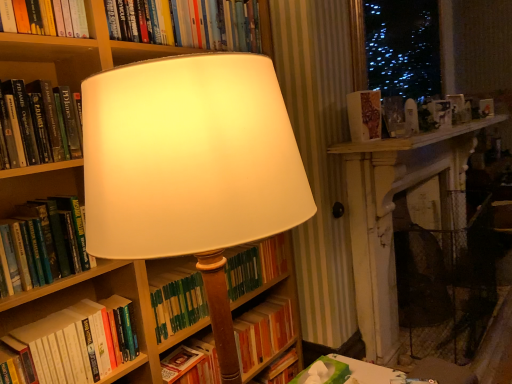
In order to face wooden bookcase at center, should I rotate leftwards or rightwards?

You should look left and rotate roughly 6.819 degrees.

Describe the element at coordinates (81, 341) in the screenshot. I see `hardcover book at left, positioned as the 6th book in top-to-bottom order` at that location.

This screenshot has height=384, width=512. I want to click on green matte book at center, which is counted as the 3th book, starting from the bottom, so click(x=177, y=300).

The width and height of the screenshot is (512, 384). I want to click on hardcover book at upper center, arranged as the first book when viewed from the top, so click(189, 23).

The image size is (512, 384). Describe the element at coordinates (189, 23) in the screenshot. I see `hardcover book at upper center, which ranks as the seventh book in bottom-to-top order` at that location.

This screenshot has height=384, width=512. Find the location of `patterned paper book at upper right, marked as the 6th book in a bottom-to-top arrangement`. patterned paper book at upper right, marked as the 6th book in a bottom-to-top arrangement is located at coordinates (364, 115).

This screenshot has height=384, width=512. Describe the element at coordinates (397, 47) in the screenshot. I see `blue lights at upper right` at that location.

The width and height of the screenshot is (512, 384). In order to click on hardcover book at left, the fourth book in the top-to-bottom sequence in this screenshot , I will do `click(45, 242)`.

Where is `wooden bookcase at center`? Image resolution: width=512 pixels, height=384 pixels. wooden bookcase at center is located at coordinates (210, 130).

From the image's perspective, count 2nd books downward from the hardcover book at left, which is the 4th book in bottom-to-top order, and point to it. Please provide its 2D coordinates.

[(81, 341)]

Is point (38, 338) less distant than point (44, 283)?

That is True.

Considering the positions of objects hardcover book at left, positioned as the 6th book in top-to-bottom order, and hardcover book at left, the fourth book in the top-to-bottom sequence, in the image provided, who is in front, hardcover book at left, positioned as the 6th book in top-to-bottom order, or hardcover book at left, the fourth book in the top-to-bottom sequence,?

hardcover book at left, the fourth book in the top-to-bottom sequence, is more forward.

Which object is further away from the camera, green matte book at center, marked as the 5th book in a top-to-bottom arrangement, or patterned paper book at upper right, which is the 2th book from top to bottom?

patterned paper book at upper right, which is the 2th book from top to bottom, is further from the camera.

Where is `book that is the 3rd one below the patterned paper book at upper right, which is the 2th book from top to bottom (from a real-world perspective)`? book that is the 3rd one below the patterned paper book at upper right, which is the 2th book from top to bottom (from a real-world perspective) is located at coordinates (177, 300).

Is hardcover book at left, which appears as the third book when viewed from the top, bigger than green hardcover book at center, which is the 1th book in bottom-to-top order?

Incorrect, hardcover book at left, which appears as the third book when viewed from the top, is not larger than green hardcover book at center, which is the 1th book in bottom-to-top order.

From a real-world perspective, does hardcover book at left, acting as the fifth book starting from the bottom, stand above green hardcover book at center, which is the 1th book in bottom-to-top order?

Yes.

Considering the sizes of hardcover book at left, which appears as the third book when viewed from the top, and green hardcover book at center, which is the 1th book in bottom-to-top order, in the image, is hardcover book at left, which appears as the third book when viewed from the top, wider or thinner than green hardcover book at center, which is the 1th book in bottom-to-top order,?

Considering their sizes, hardcover book at left, which appears as the third book when viewed from the top, looks slimmer than green hardcover book at center, which is the 1th book in bottom-to-top order.

Considering the relative sizes of patterned paper book at upper right, which is the 2th book from top to bottom, and hardcover book at left, acting as the fifth book starting from the bottom, in the image provided, is patterned paper book at upper right, which is the 2th book from top to bottom, thinner than hardcover book at left, acting as the fifth book starting from the bottom,?

Indeed, patterned paper book at upper right, which is the 2th book from top to bottom, has a lesser width compared to hardcover book at left, acting as the fifth book starting from the bottom.

Is hardcover book at left, acting as the fifth book starting from the bottom, a part of patterned paper book at upper right, marked as the 6th book in a bottom-to-top arrangement?

No, hardcover book at left, acting as the fifth book starting from the bottom, is not inside patterned paper book at upper right, marked as the 6th book in a bottom-to-top arrangement.

Consider the image. Which is less distant, (374,134) or (24,110)?

Point (24,110)

From the picture: Can you see patterned paper book at upper right, marked as the 6th book in a bottom-to-top arrangement, touching hardcover book at left, which appears as the third book when viewed from the top?

No, patterned paper book at upper right, marked as the 6th book in a bottom-to-top arrangement, is not in contact with hardcover book at left, which appears as the third book when viewed from the top.

Which point is more distant from viewer, (386,95) or (279,236)?

The point (279,236) is more distant.

Are blue lights at upper right and green matte book at center, marked as the 5th book in a top-to-bottom arrangement, far apart?

blue lights at upper right is far away from green matte book at center, marked as the 5th book in a top-to-bottom arrangement.

Would you say blue lights at upper right is to the left or to the right of green matte book at center, which is counted as the 3th book, starting from the bottom, in the picture?

Clearly, blue lights at upper right is on the right of green matte book at center, which is counted as the 3th book, starting from the bottom, in the image.

Is blue lights at upper right surrounding green matte book at center, marked as the 5th book in a top-to-bottom arrangement?

No, green matte book at center, marked as the 5th book in a top-to-bottom arrangement, is not a part of blue lights at upper right.

Considering the positions of point (366, 139) and point (369, 33), is point (366, 139) closer or farther from the camera than point (369, 33)?

Point (366, 139) appears to be closer to the viewer than point (369, 33).

Which of these two, patterned paper book at upper right, marked as the 6th book in a bottom-to-top arrangement, or blue lights at upper right, is bigger?

With larger size is blue lights at upper right.

Does patterned paper book at upper right, which is the 2th book from top to bottom, turn towards blue lights at upper right?

No, patterned paper book at upper right, which is the 2th book from top to bottom, is not facing towards blue lights at upper right.

Is point (364, 91) closer or farther from the camera than point (34, 338)?

Point (364, 91) is farther from the camera than point (34, 338).

Does patterned paper book at upper right, marked as the 6th book in a bottom-to-top arrangement, have a greater width compared to hardcover book at left, positioned as the 6th book in top-to-bottom order?

Incorrect, the width of patterned paper book at upper right, marked as the 6th book in a bottom-to-top arrangement, does not surpass that of hardcover book at left, positioned as the 6th book in top-to-bottom order.

Is the position of patterned paper book at upper right, which is the 2th book from top to bottom, less distant than that of hardcover book at left, positioned as the 6th book in top-to-bottom order?

That is False.

Is patterned paper book at upper right, marked as the 6th book in a bottom-to-top arrangement, to the left or to the right of hardcover book at left, positioned as the 6th book in top-to-bottom order, in the image?

patterned paper book at upper right, marked as the 6th book in a bottom-to-top arrangement, is to the right of hardcover book at left, positioned as the 6th book in top-to-bottom order.

Find the location of a particular element. Image resolution: width=512 pixels, height=384 pixels. book that is the 1st object to the left of the hardcover book at left, which is counted as the 2th book, starting from the bottom, starting at the anchor is located at coordinates (45, 242).

From a real-world perspective, count 3rd books downward from the patterned paper book at upper right, which is the 2th book from top to bottom, and point to it. Please provide its 2D coordinates.

[(177, 300)]

Considering their positions, is patterned paper book at upper right, marked as the 6th book in a bottom-to-top arrangement, positioned closer to hardcover book at left, acting as the fifth book starting from the bottom, than wooden bookcase at center?

wooden bookcase at center is closer to hardcover book at left, acting as the fifth book starting from the bottom.

Looking at the image, which one is located closer to hardcover book at upper center, which ranks as the seventh book in bottom-to-top order, hardcover book at left, positioned as the 6th book in top-to-bottom order, or blue lights at upper right?

Based on the image, hardcover book at left, positioned as the 6th book in top-to-bottom order, appears to be nearer to hardcover book at upper center, which ranks as the seventh book in bottom-to-top order.

Based on their spatial positions, is wooden bookcase at center or hardcover book at upper center, which ranks as the seventh book in bottom-to-top order, closer to green matte book at center, which is counted as the 3th book, starting from the bottom?

Among the two, wooden bookcase at center is located nearer to green matte book at center, which is counted as the 3th book, starting from the bottom.

Looking at the image, which one is located closer to wooden bookcase at center, patterned paper book at upper right, which is the 2th book from top to bottom, or hardcover book at upper center, arranged as the first book when viewed from the top?

hardcover book at upper center, arranged as the first book when viewed from the top, lies closer to wooden bookcase at center than the other object.

Looking at this image, from the image, which object appears to be nearer to green hardcover book at center, which appears as the seventh book when viewed from the top, wooden bookcase at center or green matte book at center, marked as the 5th book in a top-to-bottom arrangement?

green matte book at center, marked as the 5th book in a top-to-bottom arrangement, lies closer to green hardcover book at center, which appears as the seventh book when viewed from the top, than the other object.

From the image, which object appears to be farther from patterned paper book at upper right, which is the 2th book from top to bottom, green matte book at center, marked as the 5th book in a top-to-bottom arrangement, or green hardcover book at center, which is the 1th book in bottom-to-top order?

green hardcover book at center, which is the 1th book in bottom-to-top order, is further to patterned paper book at upper right, which is the 2th book from top to bottom.

Considering their positions, is hardcover book at upper center, arranged as the first book when viewed from the top, positioned further to blue lights at upper right than hardcover book at left, acting as the fifth book starting from the bottom?

hardcover book at left, acting as the fifth book starting from the bottom, is positioned further to the anchor blue lights at upper right.

When comparing their distances from wooden bookcase at center, does hardcover book at left, which appears as the third book when viewed from the top, or hardcover book at left, the fourth book in the top-to-bottom sequence, seem closer?

The object closer to wooden bookcase at center is hardcover book at left, the fourth book in the top-to-bottom sequence.

The width and height of the screenshot is (512, 384). Identify the location of bookcase located between hardcover book at left, which is counted as the 2th book, starting from the bottom, and blue lights at upper right in the left-right direction. (210, 130).

Where is `bookcase between hardcover book at left, acting as the fifth book starting from the bottom, and hardcover book at left, positioned as the 6th book in top-to-bottom order, vertically`? The image size is (512, 384). bookcase between hardcover book at left, acting as the fifth book starting from the bottom, and hardcover book at left, positioned as the 6th book in top-to-bottom order, vertically is located at coordinates (210, 130).

The image size is (512, 384). Identify the location of book between wooden bookcase at center and hardcover book at left, which appears as the third book when viewed from the top, in the front-back direction. (45, 242).

You are a GUI agent. You are given a task and a screenshot of the screen. Output one action in this format:
    pyautogui.click(x=<x>, y=<y>)
    Task: Click on the bookcase located between hardcover book at left, which appears as the third book when viewed from the top, and blue lights at upper right in the left-right direction
    This screenshot has height=384, width=512.
    Given the screenshot: What is the action you would take?
    pyautogui.click(x=210, y=130)